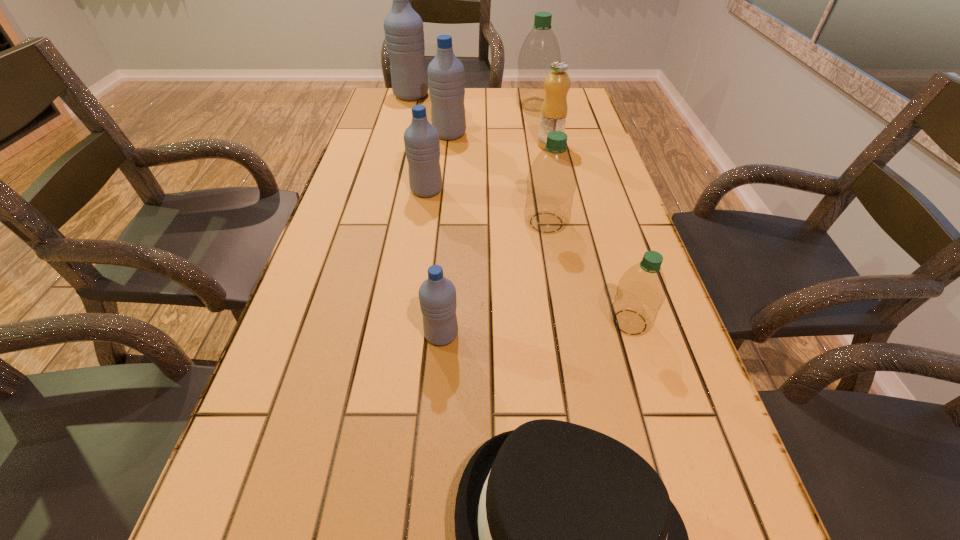
Point out which green water bottle is positioned as the third nearest to the nearest blue water bottle. Please provide its 2D coordinates. Your answer should be formatted as a tuple, i.e. [(x, y)], where the tuple contains the x and y coordinates of a point satisfying the conditions above.

[(540, 49)]

Find the location of `free location that satisfies the following two spatial constraints: 1. on the front side of the smallest blue water bottle; 2. on the right side of the leftmost blue water bottle`. free location that satisfies the following two spatial constraints: 1. on the front side of the smallest blue water bottle; 2. on the right side of the leftmost blue water bottle is located at coordinates (348, 335).